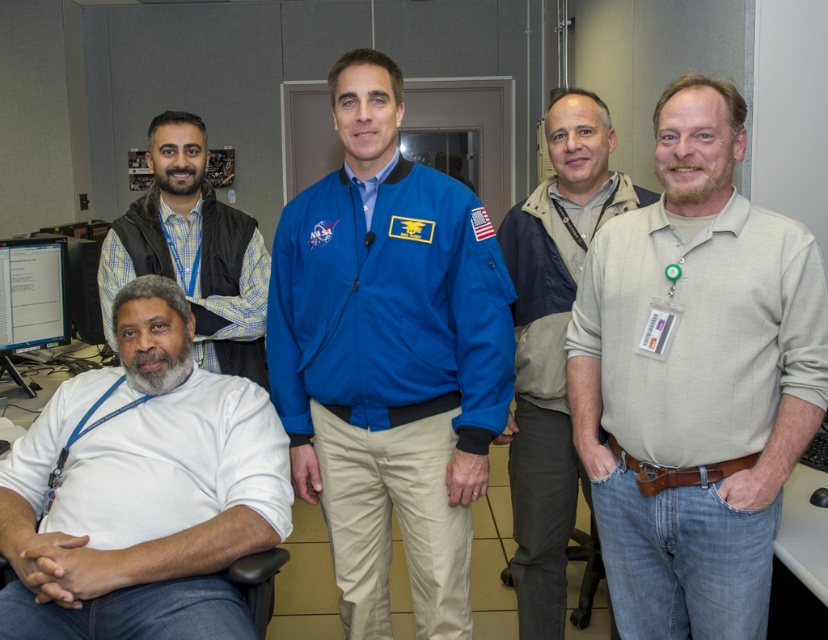
Question: Which object is farther from the camera taking this photo?

Choices:
 (A) khaki pants at center
 (B) black glossy monitor at lower left
 (C) beige cotton shirt at right

Answer: (B)

Question: Which point is closer to the camera?

Choices:
 (A) (551, 134)
 (B) (639, 602)
 (C) (331, 435)

Answer: (B)

Question: Estimate the real-world distances between objects in this image. Which object is farther from the white matte shirt at lower left?

Choices:
 (A) khaki pants at center
 (B) black glossy monitor at lower left
 (C) blue fabric jacket at center
 (D) beige cotton shirt at right

Answer: (B)

Question: Is white matte shirt at lower left smaller than khaki pants at center?

Choices:
 (A) yes
 (B) no

Answer: (B)

Question: Is blue fabric jacket at center to the left of khaki pants at center from the viewer's perspective?

Choices:
 (A) yes
 (B) no

Answer: (A)

Question: Where is white matte shirt at lower left located in relation to khaki pants at center in the image?

Choices:
 (A) below
 (B) above

Answer: (A)